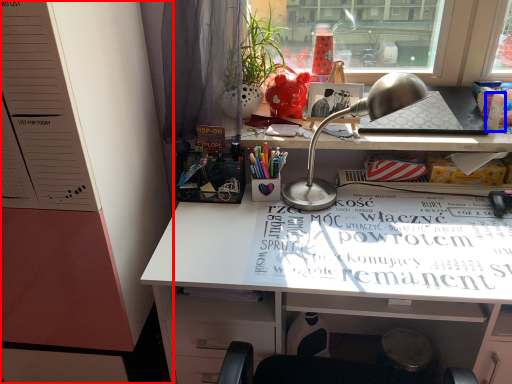
Question: Among these objects, which one is farthest to the camera, dresser (highlighted by a red box) or stationery (highlighted by a blue box)?

Choices:
 (A) dresser
 (B) stationery

Answer: (B)